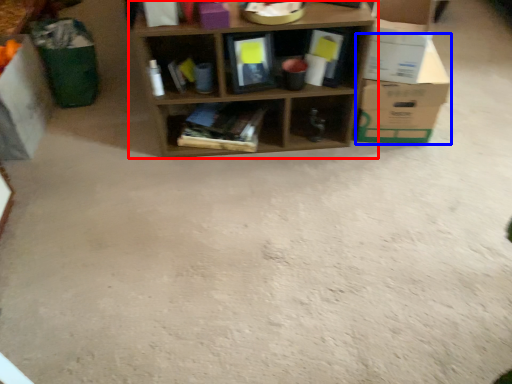
Question: Which object appears farthest to the camera in this image, shelf (highlighted by a red box) or cardboard box (highlighted by a blue box)?

Choices:
 (A) shelf
 (B) cardboard box

Answer: (B)